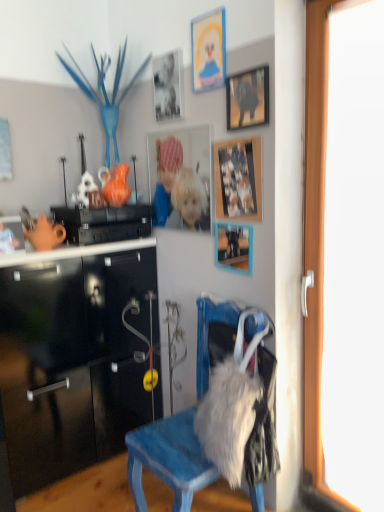
Question: From a real-world perspective, is matte plastic picture frame at center, which ranks as the 4th picture frame in top-to-bottom order, positioned above or below matte black picture frame at center, placed as the first picture frame when sorted from bottom to top?

Choices:
 (A) above
 (B) below

Answer: (A)

Question: Looking at their shapes, would you say matte plastic picture frame at center, which ranks as the 4th picture frame in top-to-bottom order, is wider or thinner than matte black picture frame at center, positioned as the 6th picture frame in top-to-bottom order?

Choices:
 (A) thin
 (B) wide

Answer: (A)

Question: Based on their relative distances, which object is farther from the matte plastic picture frame at center, the 3th picture frame positioned from the bottom?

Choices:
 (A) matte silver photo frame at upper center, the second picture frame from the top
 (B) matte cardboard picture frame at upper center, arranged as the sixth picture frame when ordered from the bottom
 (C) transparent glass door at right
 (D) matte black picture frame at center, positioned as the 6th picture frame in top-to-bottom order
 (E) wooden photo frame at upper center, which is the 5th picture frame in top-to-bottom order

Answer: (C)

Question: Based on their relative distances, which object is farther from the matte black picture frame at center, placed as the first picture frame when sorted from bottom to top?

Choices:
 (A) wooden photo frame at upper center, the second picture frame when ordered from bottom to top
 (B) transparent glass door at right
 (C) matte plastic picture frame at center, the 3th picture frame positioned from the bottom
 (D) blue painted wood chair at center
 (E) matte cardboard picture frame at upper center, arranged as the sixth picture frame when ordered from the bottom

Answer: (E)